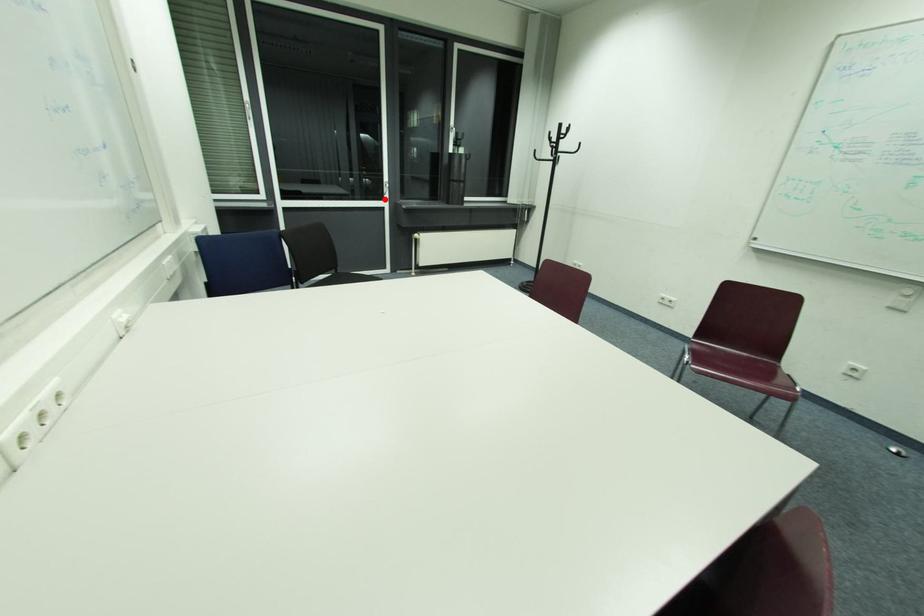
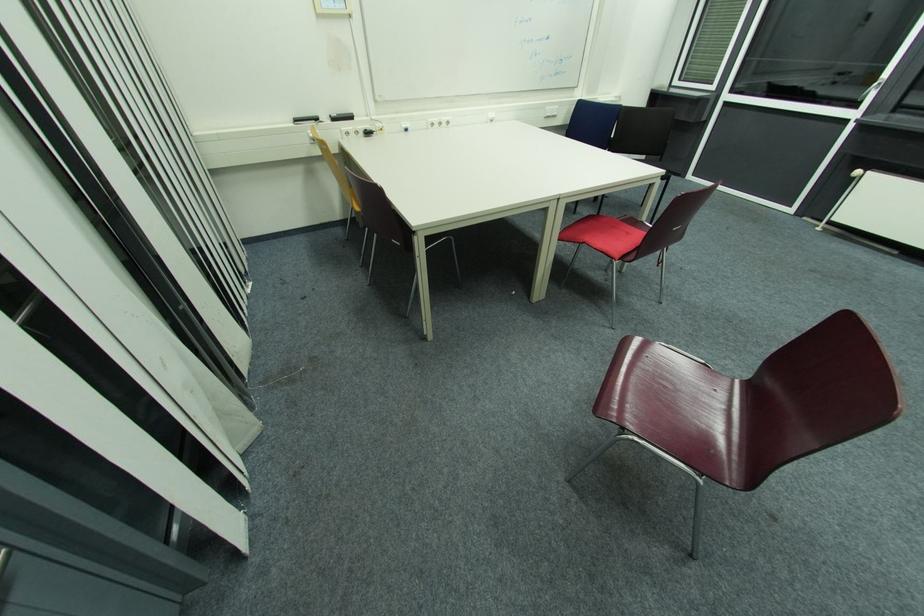
Locate, in the second image, the point that corresponds to the highlighted location in the first image.

(859, 107)